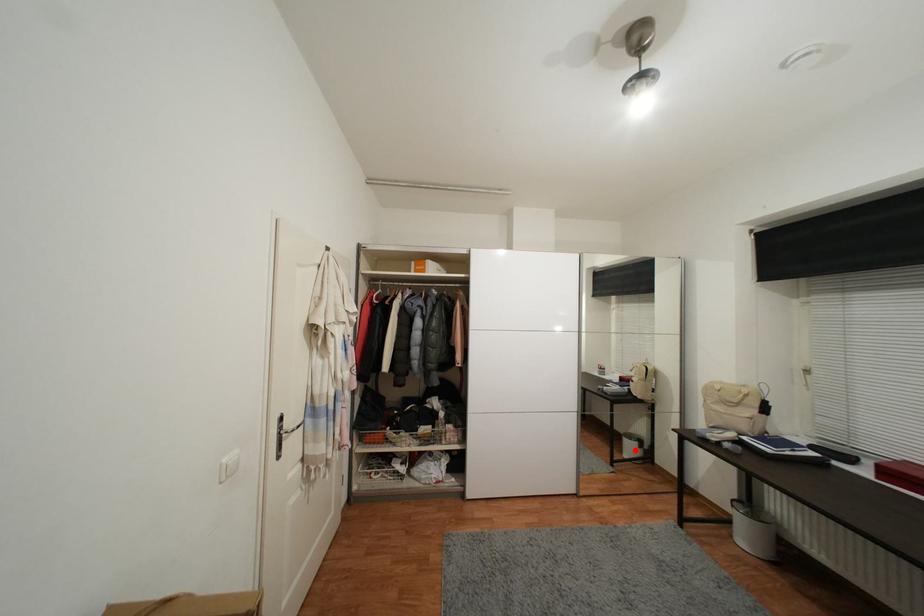
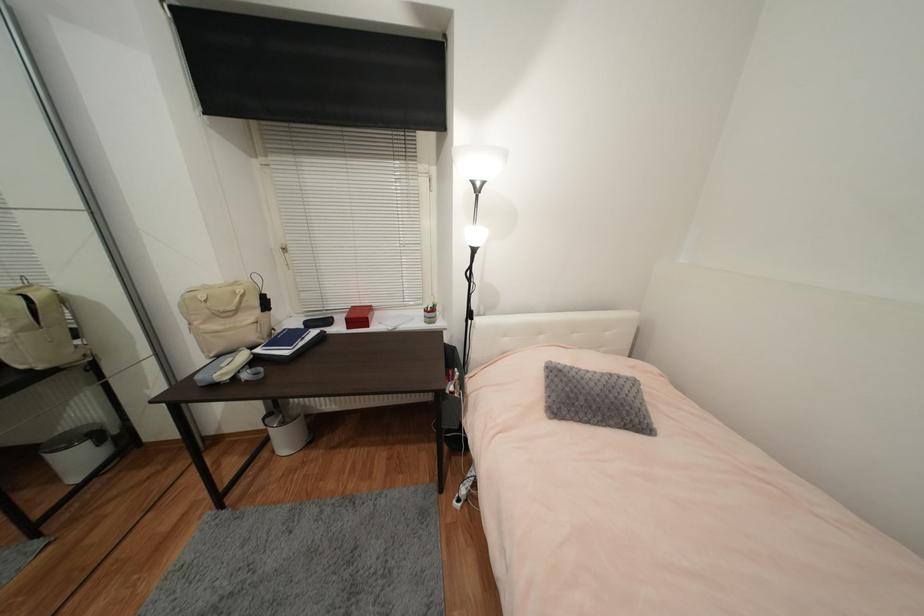
Locate, in the second image, the point that corresponds to the highlighted location in the first image.

(83, 462)